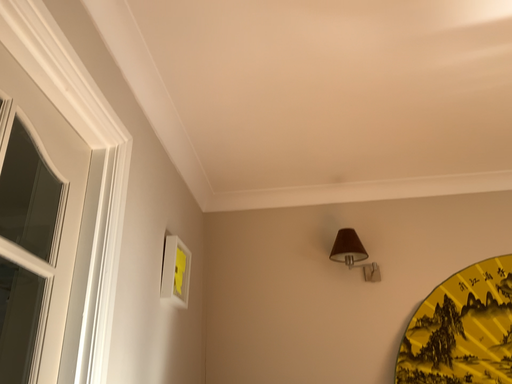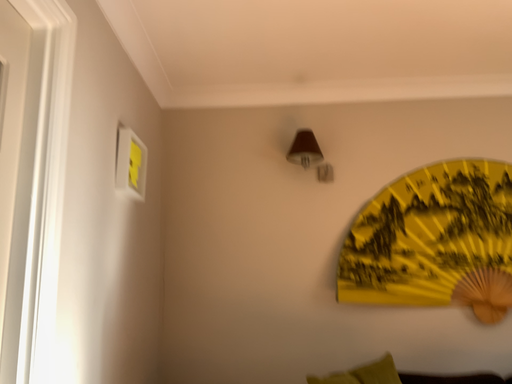
Question: How did the camera likely rotate when shooting the video?

Choices:
 (A) rotated downward
 (B) rotated upward

Answer: (A)